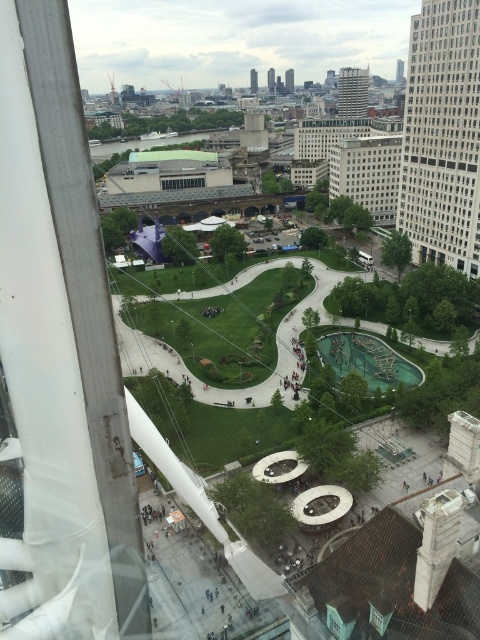
Looking at this image, you are standing at the Ferris wheel and want to identify the taller white glass building. Which one is taller between the white glass building at right and the white glass building at center?

The white glass building at right is taller than the white glass building at center according to the description.

You are a tourist visiting the city and want to take a photo of both the white glass building at right and the white glass building at center. Which building should you stand closer to in order to capture both in a single frame?

You should stand closer to the white glass building at center because it is smaller than the white glass building at right. By positioning yourself nearer to the smaller building, you can include both structures within your camera frame more effectively.